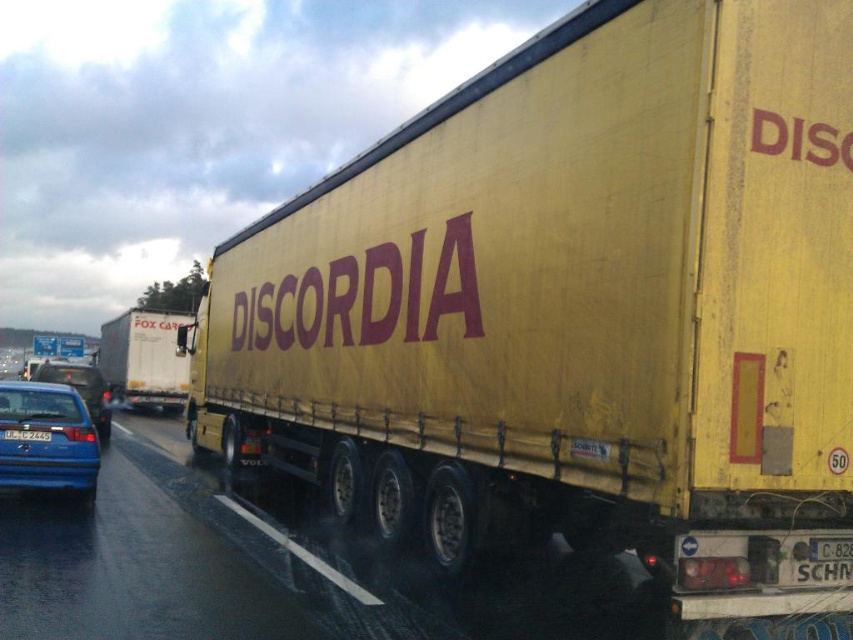
Question: Which of the following is the closest to the observer?

Choices:
 (A) blue plastic license plate at center
 (B) matte blue sedan at left
 (C) white matte truck at left
 (D) blue matte car at left

Answer: (B)

Question: Can you confirm if white matte truck at left is wider than blue matte car at left?

Choices:
 (A) yes
 (B) no

Answer: (A)

Question: Which object is positioned farthest from the white matte truck at left?

Choices:
 (A) blue matte car at left
 (B) matte blue sedan at left
 (C) blue plastic license plate at center

Answer: (C)

Question: Based on their relative distances, which object is nearer to the blue matte car at left?

Choices:
 (A) matte blue sedan at left
 (B) blue plastic license plate at center
 (C) white matte truck at left

Answer: (B)

Question: Can you confirm if matte blue sedan at left is positioned to the left of white matte truck at left?

Choices:
 (A) yes
 (B) no

Answer: (B)

Question: Can you confirm if blue matte car at left is positioned below blue plastic license plate at center?

Choices:
 (A) yes
 (B) no

Answer: (A)